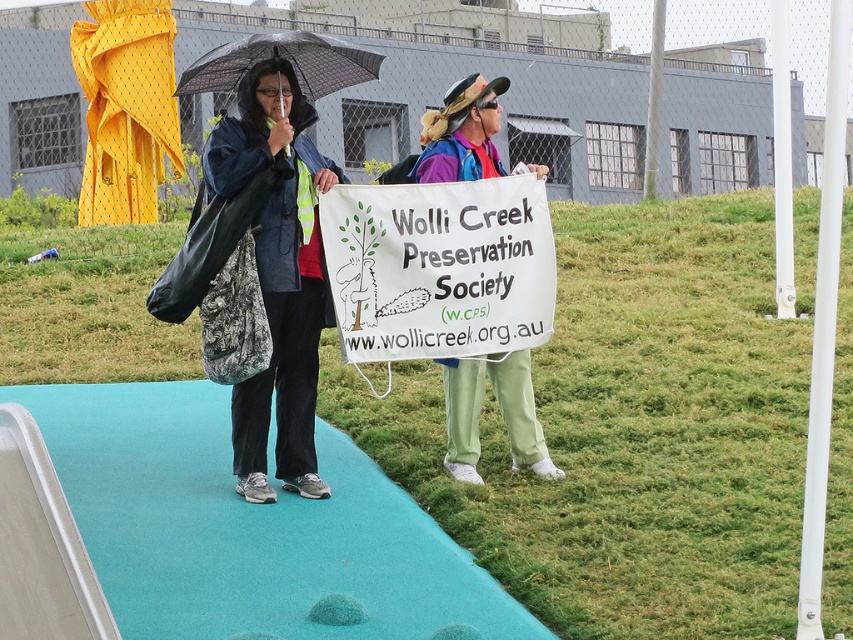
Question: Estimate the real-world distances between objects in this image. Which object is farther from the light green fabric pants at center?

Choices:
 (A) matte blue jacket at center
 (B) white paper sign at center

Answer: (A)

Question: Is matte blue jacket at center below transparent plastic umbrella at upper center?

Choices:
 (A) no
 (B) yes

Answer: (B)

Question: Which object is the farthest from the teal carpet at center?

Choices:
 (A) light green fabric pants at center
 (B) transparent plastic umbrella at upper center
 (C) matte blue jacket at center
 (D) green grass at center

Answer: (D)

Question: Which point appears closest to the camera in this image?

Choices:
 (A) (451, 461)
 (B) (289, 547)
 (C) (236, 76)

Answer: (B)

Question: Is teal carpet at center smaller than transparent plastic umbrella at upper center?

Choices:
 (A) no
 (B) yes

Answer: (A)

Question: Does green grass at center appear on the right side of matte blue jacket at center?

Choices:
 (A) yes
 (B) no

Answer: (A)